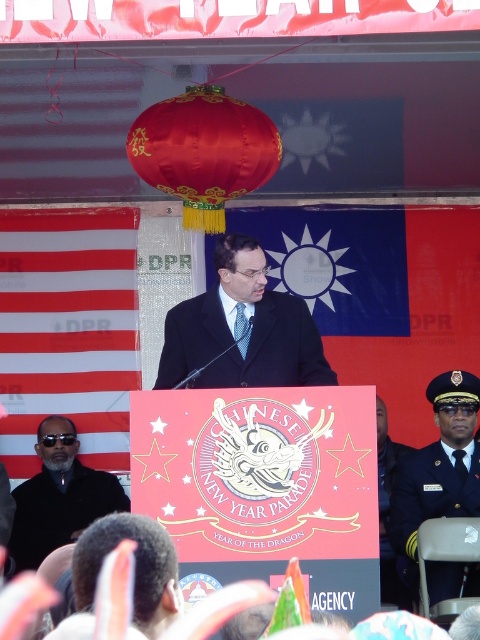
What is the exact location of the shiny silk paper lantern at upper center in the image?

The shiny silk paper lantern at upper center is located at point (204, 150).